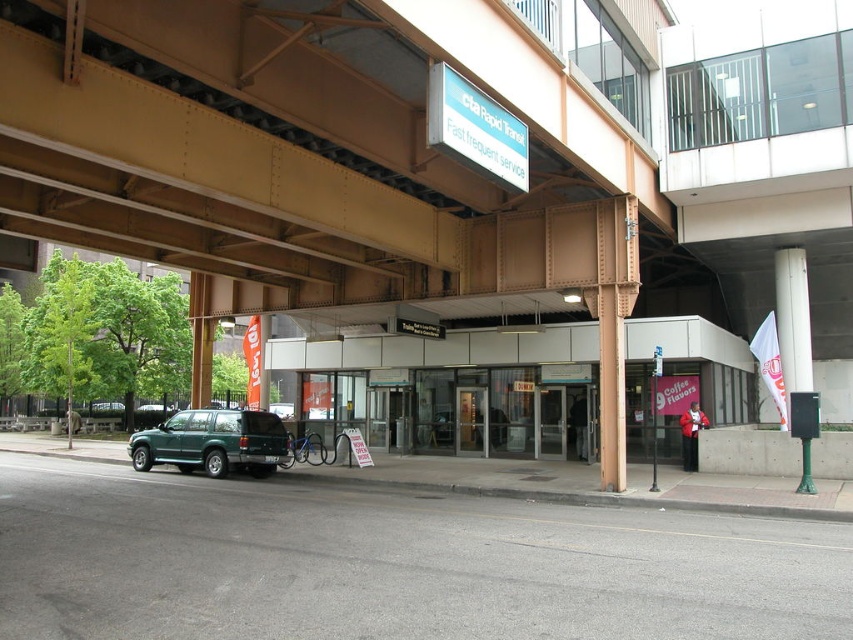
You are a delivery driver who needs to pass under the metallic brown bridge at upper center with your truck. The truck is 4 meters tall. Can you safely pass under the bridge without hitting it? Consider the presence of the green matte suv at lower left in your assessment.

The metallic brown bridge at upper center is taller than the green matte suv at lower left. Since the SUV is parked under the bridge and the bridge is taller than the SUV, the truck at 4 meters should have enough clearance to pass safely, provided the SUV doesn

You are a delivery driver who needs to park your vehicle in the parking garage. From your current position at the entrance of the Cta Rapid Transit station, which direction should you drive to reach the metallic gray parking garage at center?

The metallic gray parking garage at center is located at coordinates (450,387), so you should drive towards the center of the image to reach it.

You are a delivery driver who needs to navigate through the transit station area. The metallic brown bridge at upper center and the green matte suv at lower left are in your path. Which object should you avoid hitting if you want to pass through the area safely?

You should avoid hitting the metallic brown bridge at upper center because it is larger in size than the green matte suv at lower left, making it a more significant obstacle in your path.